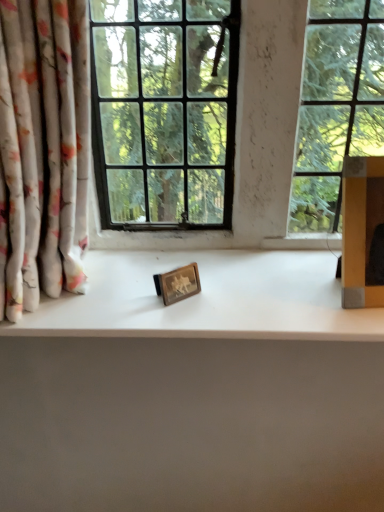
Find the location of `free location above white matte counter top at center (from a real-world perspective)`. free location above white matte counter top at center (from a real-world perspective) is located at coordinates (205, 281).